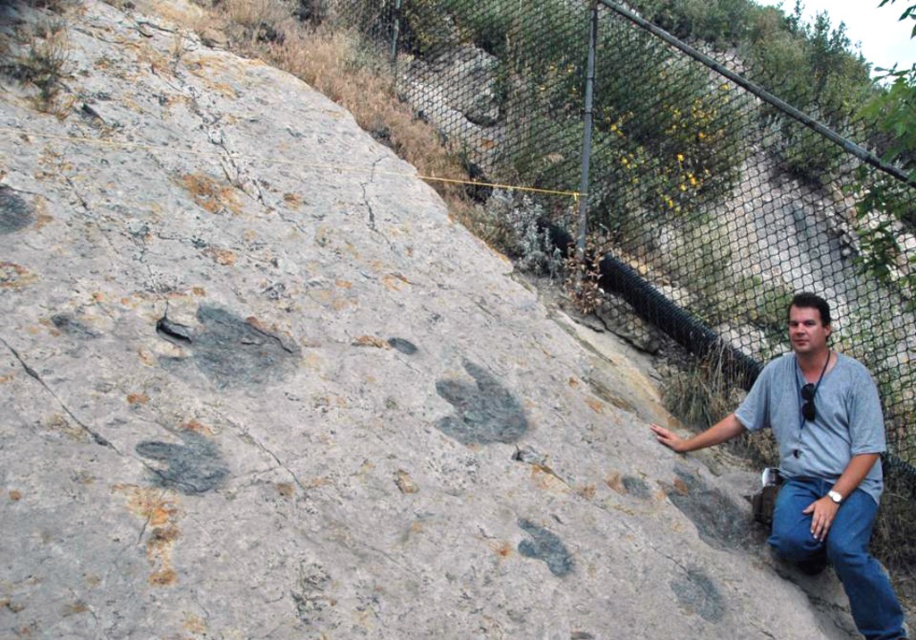
Is point (911, 356) positioned before point (780, 525)?

No, it is behind (780, 525).

Is metal mesh fence at upper right positioned in front of gray cotton shirt at lower right?

No, metal mesh fence at upper right is behind gray cotton shirt at lower right.

Who is more distant from viewer, (820, 276) or (865, 486)?

Point (820, 276)

Identify the location of metal mesh fence at upper right. The height and width of the screenshot is (640, 916). pyautogui.click(x=669, y=176).